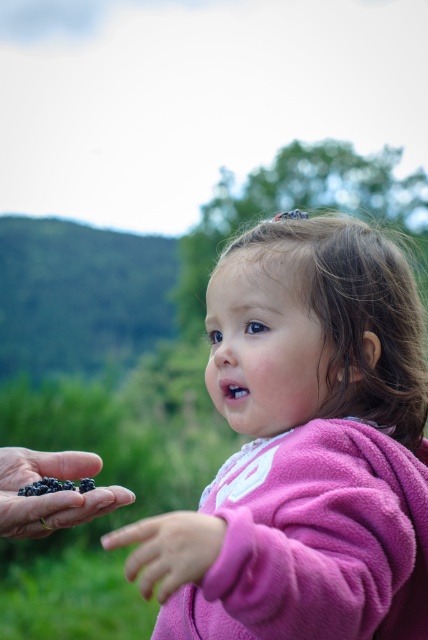
Based on the photo, you are a photographer trying to capture the perfect shot of the child and the berries. You notice two points in the image labeled as point (44, 531) and point (151, 568). Based on their positions, which point is closer to the camera?

Point (151, 568) is closer to the camera because point (44, 531) is behind it.

From the picture: You are a photographer trying to capture the interaction between the child and the adult in the image. Since you want to focus on the connection between the pink fleece jacket at center and the pink fleece hand at lower center, which object should you position closer to the left side of the frame?

The pink fleece hand at lower center should be positioned closer to the left side of the frame because the pink fleece jacket at center is to the right of it.